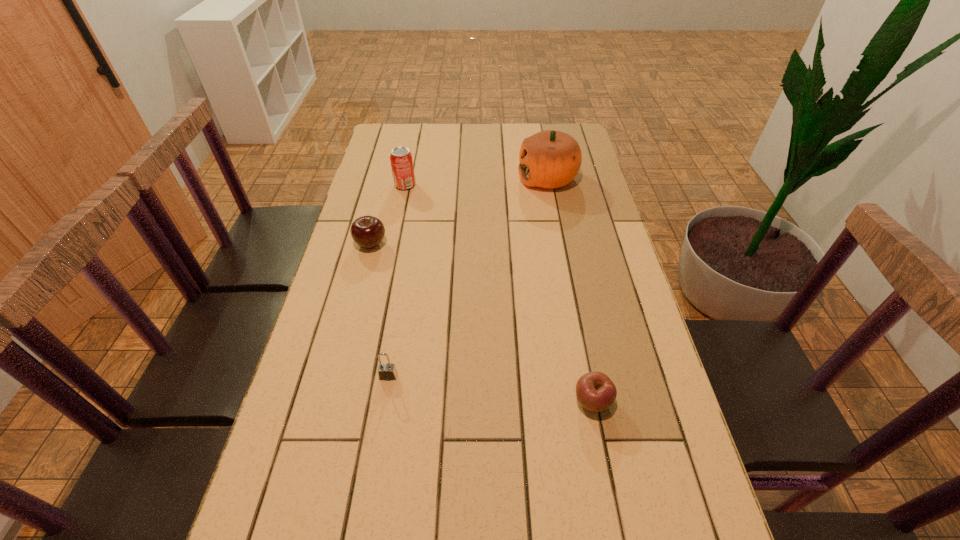
Identify which object is the fourth closest to the fourth shortest object. Please provide its 2D coordinates. Your answer should be formatted as a tuple, i.e. [(x, y)], where the tuple contains the x and y coordinates of a point satisfying the conditions above.

[(595, 391)]

The width and height of the screenshot is (960, 540). I want to click on object that stands as the third closest to the fourth farthest object, so click(x=401, y=160).

What are the coordinates of `vacant space that satisfies the following two spatial constraints: 1. on the face of the tallest object; 2. on the front side of the left apple` in the screenshot? It's located at (560, 244).

The width and height of the screenshot is (960, 540). I want to click on blank area in the image that satisfies the following two spatial constraints: 1. on the face of the pumpkin; 2. on the front side of the taller apple, so coord(560,244).